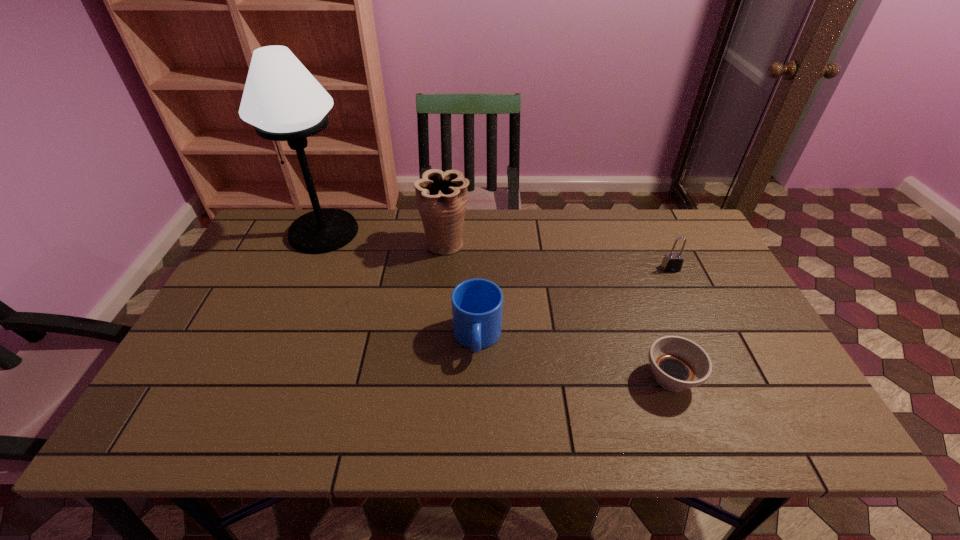
Where is `free location at the right edge`? The height and width of the screenshot is (540, 960). free location at the right edge is located at coordinates (722, 300).

What are the coordinates of `free location at the far left corner` in the screenshot? It's located at (289, 226).

The image size is (960, 540). I want to click on vacant space at the far right corner, so click(692, 232).

Where is `free space that is in between the mug and the shortest object`? free space that is in between the mug and the shortest object is located at coordinates (574, 358).

You are a GUI agent. You are given a task and a screenshot of the screen. Output one action in this format:
    pyautogui.click(x=<x>, y=<y>)
    Task: Click on the vacant region between the mug and the fourth object from left to right
    
    Given the screenshot: What is the action you would take?
    pyautogui.click(x=574, y=358)

At what (x,y) coordinates should I click in order to perform the action: click on blank region between the rightmost object and the second tallest object. Please return your answer as a coordinate pair (x, y). Looking at the image, I should click on (558, 256).

Where is `free space between the mug and the table lamp`? free space between the mug and the table lamp is located at coordinates (400, 285).

Locate an element on the screen. free space that is in between the table lamp and the mug is located at coordinates (400, 285).

What are the coordinates of `vacant space that's between the mug and the third nearest object` in the screenshot? It's located at (574, 303).

I want to click on vacant region between the mug and the soup bowl, so click(574, 358).